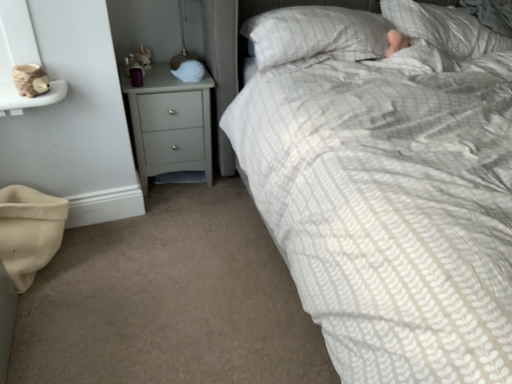
Where is `matte gray chest of drawers at center-left`? The height and width of the screenshot is (384, 512). matte gray chest of drawers at center-left is located at coordinates (170, 124).

What do you see at coordinates (315, 34) in the screenshot?
I see `white textured pillow at upper center, positioned as the 2th pillow in right-to-left order` at bounding box center [315, 34].

You are a GUI agent. You are given a task and a screenshot of the screen. Output one action in this format:
    pyautogui.click(x=<x>, y=<y>)
    Task: Click on the white textured pillow at upper right, arranged as the first pillow when viewed from the right
    Image resolution: width=512 pixels, height=384 pixels.
    Given the screenshot: What is the action you would take?
    pyautogui.click(x=444, y=28)

Which object is positioned more to the left, white textured pillow at upper center, positioned as the 2th pillow in right-to-left order, or matte gray chest of drawers at center-left?

matte gray chest of drawers at center-left is more to the left.

Can you confirm if white textured pillow at upper center, positioned as the 2th pillow in right-to-left order, is taller than matte gray chest of drawers at center-left?

No, white textured pillow at upper center, positioned as the 2th pillow in right-to-left order, is not taller than matte gray chest of drawers at center-left.

From a real-world perspective, is white textured pillow at upper center, positioned as the 2th pillow in right-to-left order, under matte gray chest of drawers at center-left?

No, from a real-world perspective, white textured pillow at upper center, positioned as the 2th pillow in right-to-left order, is not below matte gray chest of drawers at center-left.

You are a GUI agent. You are given a task and a screenshot of the screen. Output one action in this format:
    pyautogui.click(x=<x>, y=<y>)
    Task: Click on the chest of drawers lying behind the white textured pillow at upper center, arranged as the 1th pillow when viewed from the left
    The image size is (512, 384).
    Given the screenshot: What is the action you would take?
    pyautogui.click(x=170, y=124)

Could you measure the distance between white textured pillow at upper right, arranged as the first pillow when viewed from the right, and white textured pillow at upper center, arranged as the 1th pillow when viewed from the left?

white textured pillow at upper right, arranged as the first pillow when viewed from the right, is 40.89 centimeters from white textured pillow at upper center, arranged as the 1th pillow when viewed from the left.

Is white textured pillow at upper right, positioned as the second pillow in left-to-right order, bigger or smaller than white textured pillow at upper center, arranged as the 1th pillow when viewed from the left?

white textured pillow at upper right, positioned as the second pillow in left-to-right order, is bigger than white textured pillow at upper center, arranged as the 1th pillow when viewed from the left.

From the picture: Can you confirm if white textured pillow at upper right, positioned as the second pillow in left-to-right order, is positioned to the right of white textured pillow at upper center, arranged as the 1th pillow when viewed from the left?

Yes, white textured pillow at upper right, positioned as the second pillow in left-to-right order, is to the right of white textured pillow at upper center, arranged as the 1th pillow when viewed from the left.

Is white textured pillow at upper right, positioned as the second pillow in left-to-right order, further to camera compared to white textured pillow at upper center, positioned as the 2th pillow in right-to-left order?

Yes, it is behind white textured pillow at upper center, positioned as the 2th pillow in right-to-left order.

Is white textured pillow at upper right, positioned as the second pillow in left-to-right order, located outside matte gray chest of drawers at center-left?

white textured pillow at upper right, positioned as the second pillow in left-to-right order, lies outside matte gray chest of drawers at center-left's area.

Which is behind, white textured pillow at upper right, arranged as the first pillow when viewed from the right, or matte gray chest of drawers at center-left?

matte gray chest of drawers at center-left is more distant.

Does point (386, 14) come farther from viewer compared to point (164, 63)?

No, (386, 14) is in front of (164, 63).

Is matte gray chest of drawers at center-left wider than white textured pillow at upper center, positioned as the 2th pillow in right-to-left order?

In fact, matte gray chest of drawers at center-left might be narrower than white textured pillow at upper center, positioned as the 2th pillow in right-to-left order.

Does matte gray chest of drawers at center-left come behind white textured pillow at upper center, positioned as the 2th pillow in right-to-left order?

Yes, it is behind white textured pillow at upper center, positioned as the 2th pillow in right-to-left order.

Is matte gray chest of drawers at center-left facing towards white textured pillow at upper center, arranged as the 1th pillow when viewed from the left?

No, matte gray chest of drawers at center-left is not turned towards white textured pillow at upper center, arranged as the 1th pillow when viewed from the left.

Is matte gray chest of drawers at center-left oriented towards white textured pillow at upper right, positioned as the second pillow in left-to-right order?

No, matte gray chest of drawers at center-left is not aimed at white textured pillow at upper right, positioned as the second pillow in left-to-right order.

Is matte gray chest of drawers at center-left wider or thinner than white textured pillow at upper right, arranged as the first pillow when viewed from the right?

Considering their sizes, matte gray chest of drawers at center-left looks slimmer than white textured pillow at upper right, arranged as the first pillow when viewed from the right.

Is matte gray chest of drawers at center-left not close to white textured pillow at upper right, arranged as the first pillow when viewed from the right?

Absolutely, matte gray chest of drawers at center-left is distant from white textured pillow at upper right, arranged as the first pillow when viewed from the right.

From the image's perspective, is matte gray chest of drawers at center-left above or below white textured pillow at upper right, positioned as the second pillow in left-to-right order?

matte gray chest of drawers at center-left is below white textured pillow at upper right, positioned as the second pillow in left-to-right order.

Where is `pillow on the right of white textured pillow at upper center, arranged as the 1th pillow when viewed from the left`? The width and height of the screenshot is (512, 384). pillow on the right of white textured pillow at upper center, arranged as the 1th pillow when viewed from the left is located at coordinates (444, 28).

Considering the relative positions of white textured pillow at upper center, arranged as the 1th pillow when viewed from the left, and white textured pillow at upper right, positioned as the second pillow in left-to-right order, in the image provided, is white textured pillow at upper center, arranged as the 1th pillow when viewed from the left, to the right of white textured pillow at upper right, positioned as the second pillow in left-to-right order, from the viewer's perspective?

Result: No, white textured pillow at upper center, arranged as the 1th pillow when viewed from the left, is not to the right of white textured pillow at upper right, positioned as the second pillow in left-to-right order.

Does white textured pillow at upper center, arranged as the 1th pillow when viewed from the left, contain white textured pillow at upper right, arranged as the first pillow when viewed from the right?

No, white textured pillow at upper right, arranged as the first pillow when viewed from the right, is located outside of white textured pillow at upper center, arranged as the 1th pillow when viewed from the left.

In the image, there is a white textured pillow at upper center, arranged as the 1th pillow when viewed from the left. At what (x,y) coordinates should I click in order to perform the action: click on the chest of drawers below it (from a real-world perspective). Please return your answer as a coordinate pair (x, y). This screenshot has height=384, width=512. Looking at the image, I should click on (170, 124).

Identify the location of pillow located above the white textured pillow at upper center, arranged as the 1th pillow when viewed from the left (from the image's perspective). (444, 28).

Looking at the image, which one is located further to white textured pillow at upper center, arranged as the 1th pillow when viewed from the left, matte gray chest of drawers at center-left or white textured pillow at upper right, arranged as the first pillow when viewed from the right?

matte gray chest of drawers at center-left is further to white textured pillow at upper center, arranged as the 1th pillow when viewed from the left.

Considering their positions, is white textured pillow at upper right, positioned as the second pillow in left-to-right order, positioned closer to matte gray chest of drawers at center-left than white textured pillow at upper center, arranged as the 1th pillow when viewed from the left?

The object closer to matte gray chest of drawers at center-left is white textured pillow at upper center, arranged as the 1th pillow when viewed from the left.

From the image, which object appears to be farther from white textured pillow at upper center, positioned as the 2th pillow in right-to-left order, white textured pillow at upper right, positioned as the second pillow in left-to-right order, or matte gray chest of drawers at center-left?

Among the two, matte gray chest of drawers at center-left is located further to white textured pillow at upper center, positioned as the 2th pillow in right-to-left order.

Considering their positions, is white textured pillow at upper center, arranged as the 1th pillow when viewed from the left, positioned closer to matte gray chest of drawers at center-left than white textured pillow at upper right, positioned as the second pillow in left-to-right order?

white textured pillow at upper center, arranged as the 1th pillow when viewed from the left, lies closer to matte gray chest of drawers at center-left than the other object.

Looking at the image, which one is located closer to white textured pillow at upper right, positioned as the second pillow in left-to-right order, white textured pillow at upper center, arranged as the 1th pillow when viewed from the left, or matte gray chest of drawers at center-left?

white textured pillow at upper center, arranged as the 1th pillow when viewed from the left.

Estimate the real-world distances between objects in this image. Which object is closer to white textured pillow at upper right, arranged as the first pillow when viewed from the right, matte gray chest of drawers at center-left or white textured pillow at upper center, arranged as the 1th pillow when viewed from the left?

white textured pillow at upper center, arranged as the 1th pillow when viewed from the left, lies closer to white textured pillow at upper right, arranged as the first pillow when viewed from the right, than the other object.

This screenshot has height=384, width=512. In order to click on pillow situated between matte gray chest of drawers at center-left and white textured pillow at upper right, positioned as the second pillow in left-to-right order, from left to right in this screenshot , I will do `click(315, 34)`.